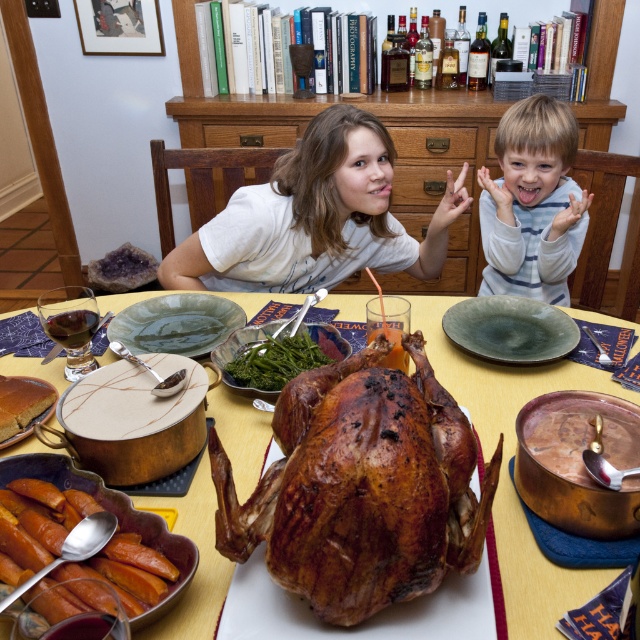
Does shiny orange glazed carrots at lower left have a lesser width compared to green leafy vegetables at center?

No.

Can you confirm if shiny orange glazed carrots at lower left is shorter than green leafy vegetables at center?

Yes.

This screenshot has height=640, width=640. Find the location of `shiny orange glazed carrots at lower left`. shiny orange glazed carrots at lower left is located at coordinates (99, 550).

In the scene shown: Between light brown striped shirt at upper right and green ceramic platter at center, which one appears on the left side from the viewer's perspective?

green ceramic platter at center is more to the left.

Between point (538, 269) and point (132, 332), which one is positioned in front?

Positioned in front is point (132, 332).

Who is more forward, (547, 252) or (148, 336)?

Positioned in front is point (148, 336).

The width and height of the screenshot is (640, 640). I want to click on light brown striped shirt at upper right, so click(x=532, y=204).

Between shiny copper pot at center and green matte platter at center, which one is positioned higher?

Positioned higher is green matte platter at center.

Does point (563, 577) lie in front of point (534, 362)?

Yes.

Between point (240, 461) and point (465, 321), which one is positioned in front?

Positioned in front is point (240, 461).

Locate an element on the screen. shiny copper pot at center is located at coordinates (506, 467).